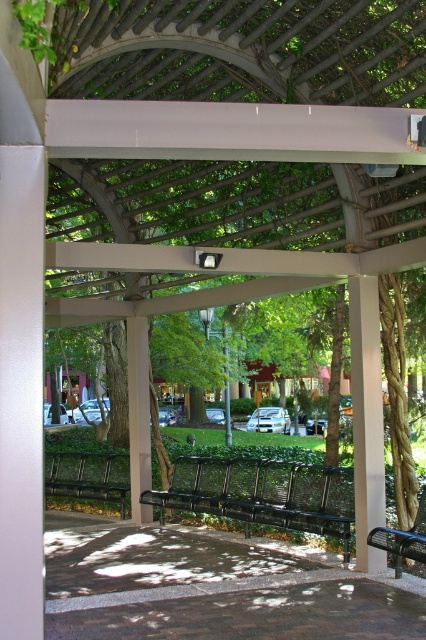
Looking at this image, who is lower down, metallic green bench at lower left or metallic silver bench at lower right?

metallic green bench at lower left is below.

Based on the photo, is metallic green bench at lower left thinner than metallic silver bench at lower right?

Incorrect, metallic green bench at lower left's width is not less than metallic silver bench at lower right's.

Does point (118, 465) lie in front of point (368, 541)?

That is False.

The height and width of the screenshot is (640, 426). What are the coordinates of `metallic green bench at lower left` in the screenshot? It's located at (88, 476).

How much distance is there between black mesh bench at center and metallic silver bench at lower right?

The distance of black mesh bench at center from metallic silver bench at lower right is 1.50 meters.

Which is behind, point (264, 497) or point (422, 496)?

The point (264, 497) is behind.

Which is in front, point (307, 481) or point (409, 538)?

Positioned in front is point (409, 538).

I want to click on black mesh bench at center, so click(262, 493).

Is black mesh bench at center taller than metallic green bench at lower left?

Yes, black mesh bench at center is taller than metallic green bench at lower left.

Does black mesh bench at center have a lesser height compared to metallic green bench at lower left?

No, black mesh bench at center is not shorter than metallic green bench at lower left.

Is point (267, 484) more distant than point (74, 493)?

That is False.

Where is `black mesh bench at center`? This screenshot has height=640, width=426. black mesh bench at center is located at coordinates (262, 493).